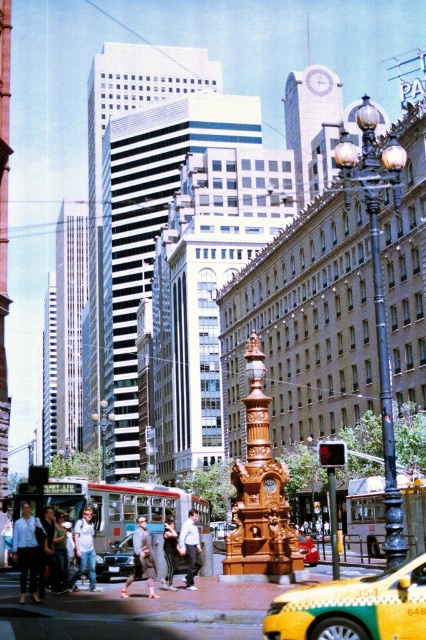
You are a pedestrian standing at the intersection and see both the light blue shirt at center and the metallic red car at center. Which object is nearer to you?

The light blue shirt at center is closer to the viewer than the metallic red car at center.

You are standing at the intersection and want to determine which of the two points, point (121, 573) or point (164, 532), is closer to you. Based on the scene, which point is nearer?

Point (121, 573) is closer to you because it is further to the viewer than point (164, 532) according to the description.